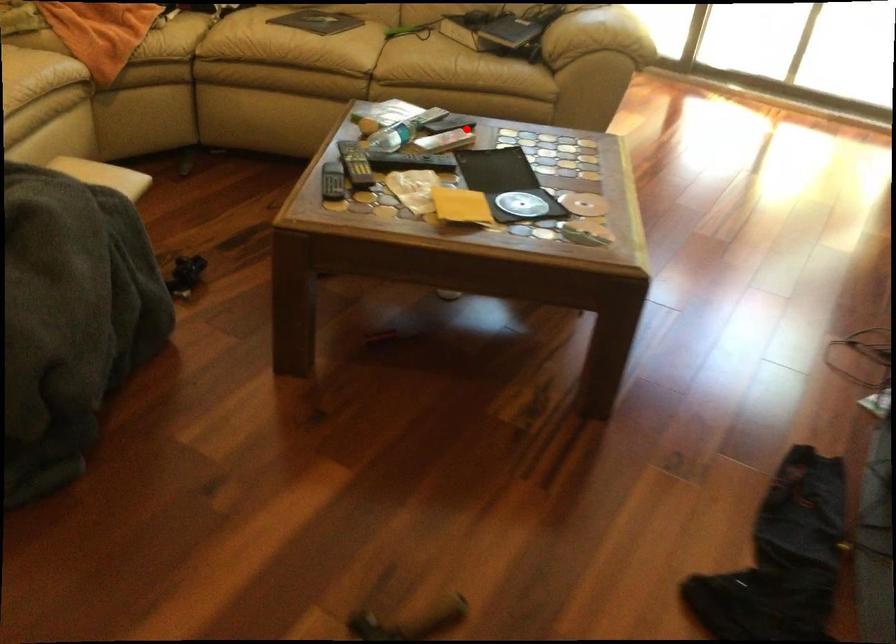
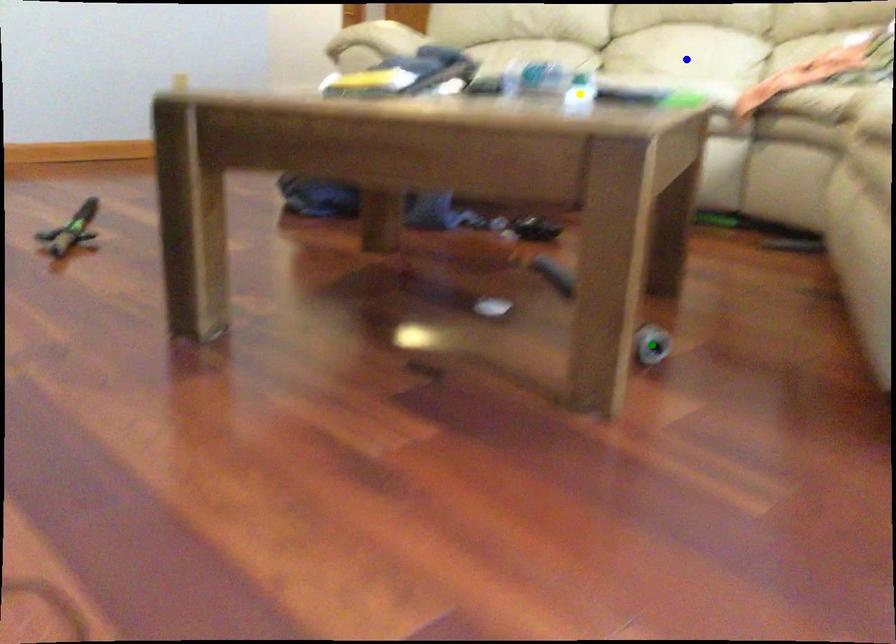
Question: I am providing you with two images of the same scene from different viewpoints. A red point is marked on the first image. You are given multiple points on the second image. In image 2, which mark is for the same physical point as the one in image 1?

Choices:
 (A) yellow point
 (B) blue point
 (C) green point

Answer: (A)